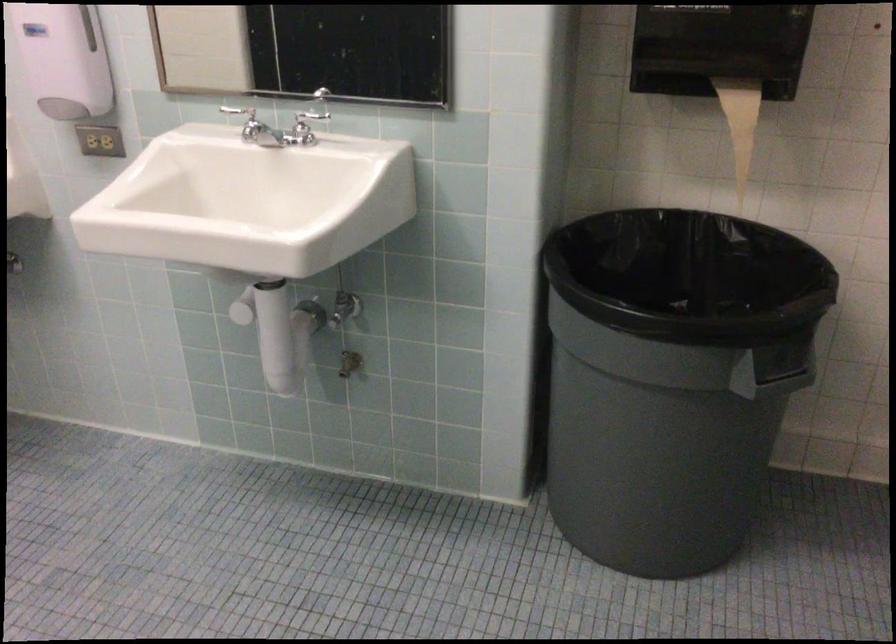
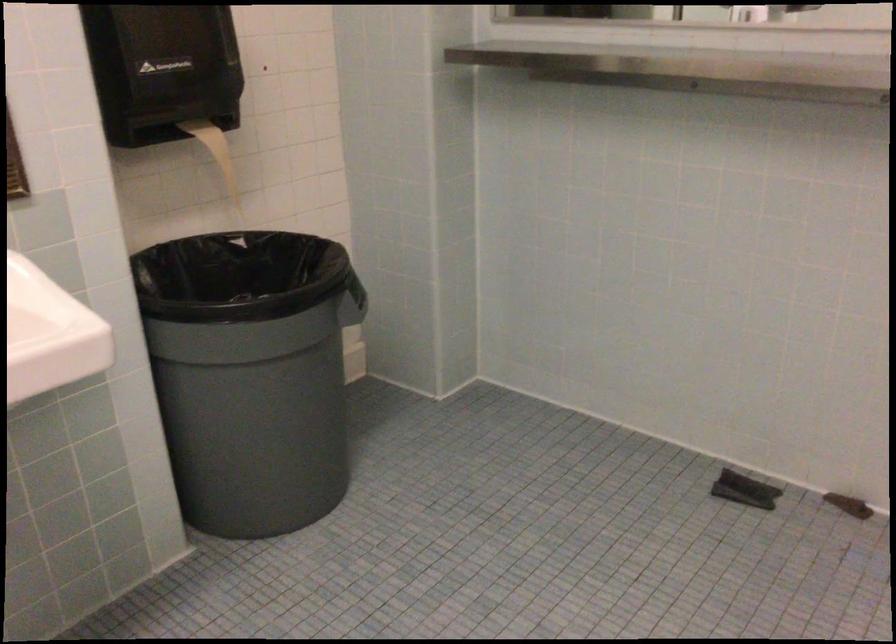
The point at (742, 261) is marked in the first image. Where is the corresponding point in the second image?

(228, 266)